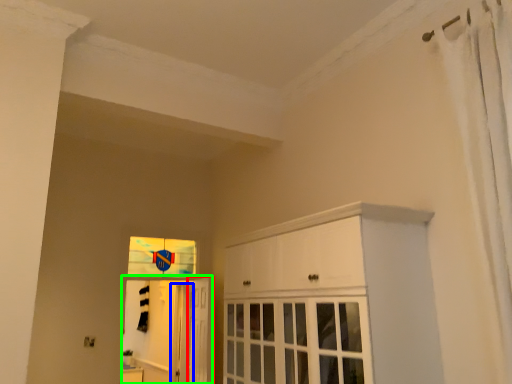
Question: Estimate the real-world distances between objects in this image. Which object is farther from door (highlighted by a red box), screen door (highlighted by a blue box) or elevator (highlighted by a green box)?

Choices:
 (A) screen door
 (B) elevator

Answer: (B)